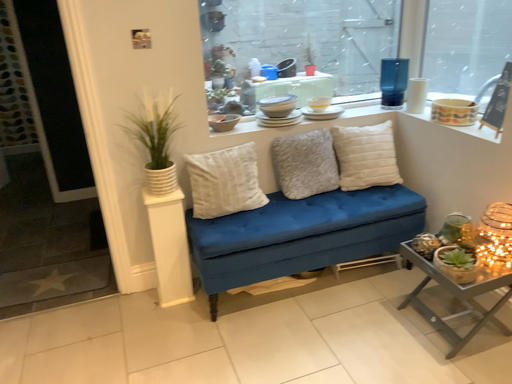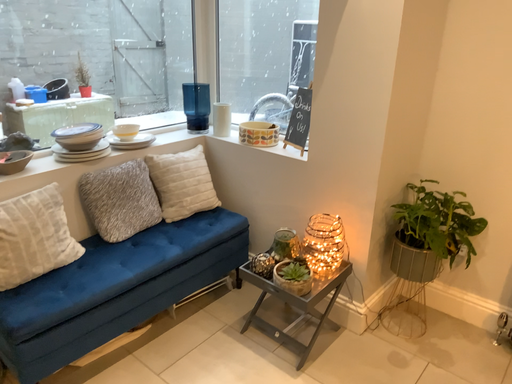
Question: How did the camera likely rotate when shooting the video?

Choices:
 (A) rotated left
 (B) rotated right

Answer: (B)